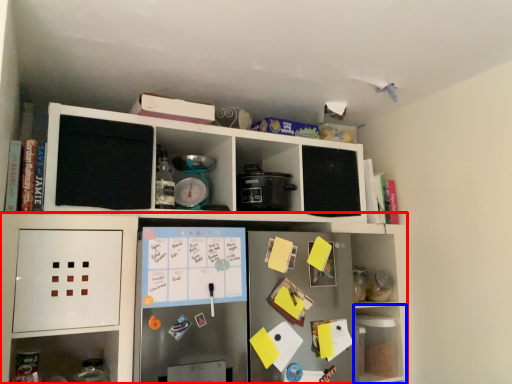
Question: Among these objects, which one is nearest to the camera, shelf (highlighted by a red box) or shelf (highlighted by a blue box)?

Choices:
 (A) shelf
 (B) shelf

Answer: (A)